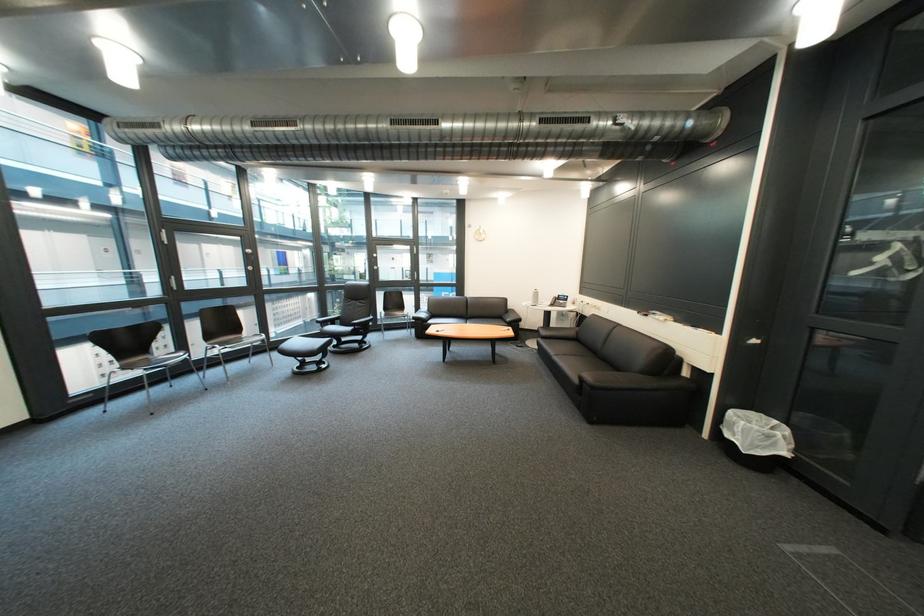
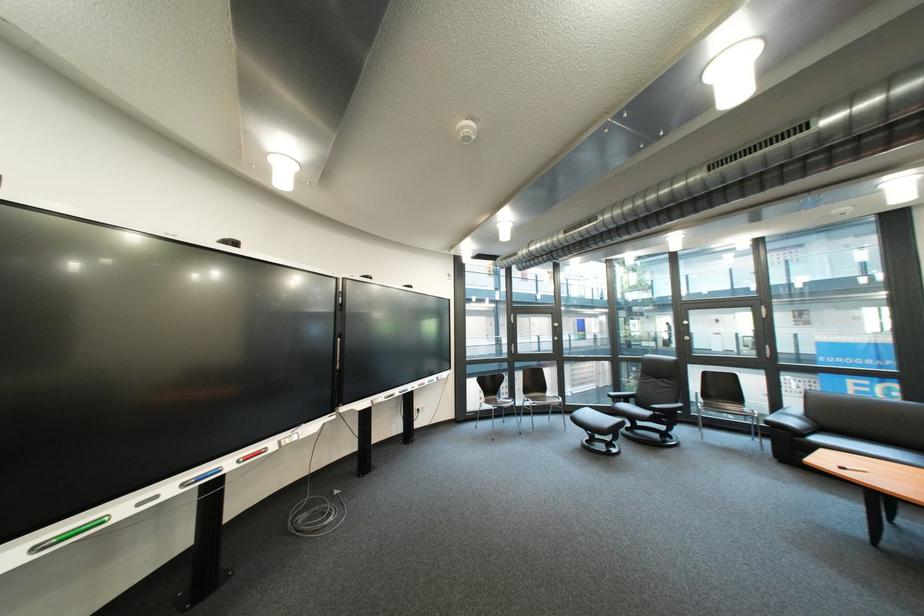
Locate, in the second image, the point that corresponds to [442,312] in the first image.

(822, 418)